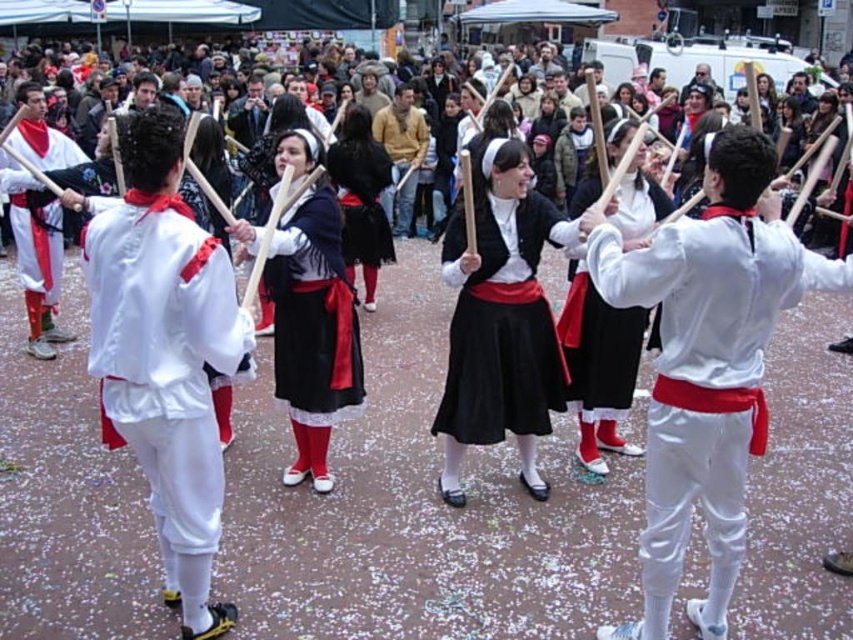
In the scene shown: Is the position of matte black dress at center more distant than that of matte white blouse at center?

No, it is in front of matte white blouse at center.

Describe the element at coordinates (312, 330) in the screenshot. Image resolution: width=853 pixels, height=640 pixels. I see `matte black dress at center` at that location.

Find the location of a particular element. matte black dress at center is located at coordinates pyautogui.click(x=312, y=330).

Which is above, white satin jacket at center or white matte pants at left?

white matte pants at left is above.

Does white satin jacket at center appear on the left side of white matte pants at left?

In fact, white satin jacket at center is to the right of white matte pants at left.

Is point (131, 440) positioned in front of point (33, 189)?

Yes, it is in front of point (33, 189).

At what (x,y) coordinates should I click in order to perform the action: click on white satin jacket at center. Please return your answer as a coordinate pair (x, y). Looking at the image, I should click on (165, 355).

Does matte white blouse at center have a greater width compared to white matte pants at left?

No, matte white blouse at center is not wider than white matte pants at left.

Does matte white blouse at center appear on the right side of white matte pants at left?

Indeed, matte white blouse at center is positioned on the right side of white matte pants at left.

Does point (576, 252) come behind point (56, 228)?

That is False.

What are the coordinates of `matte white blouse at center` in the screenshot? It's located at (599, 364).